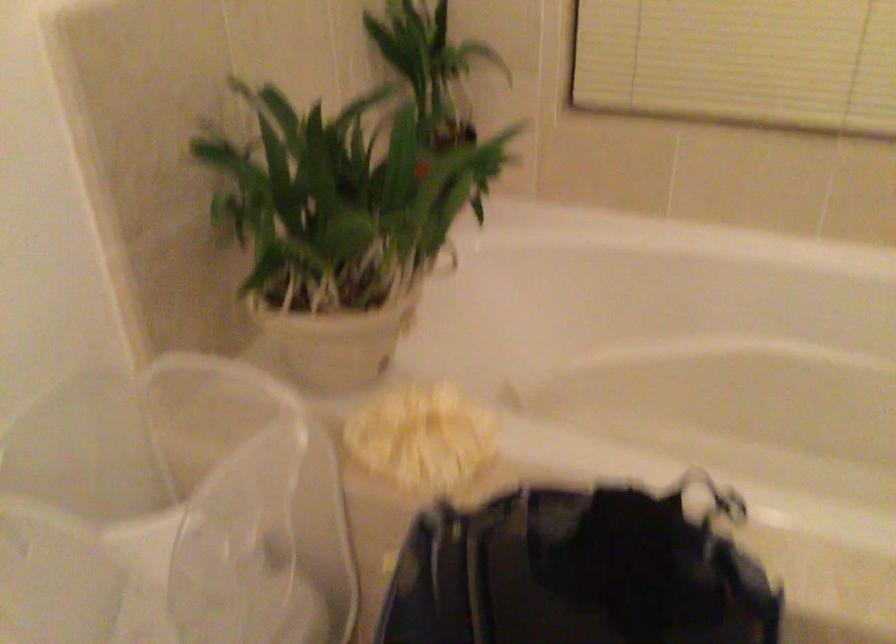
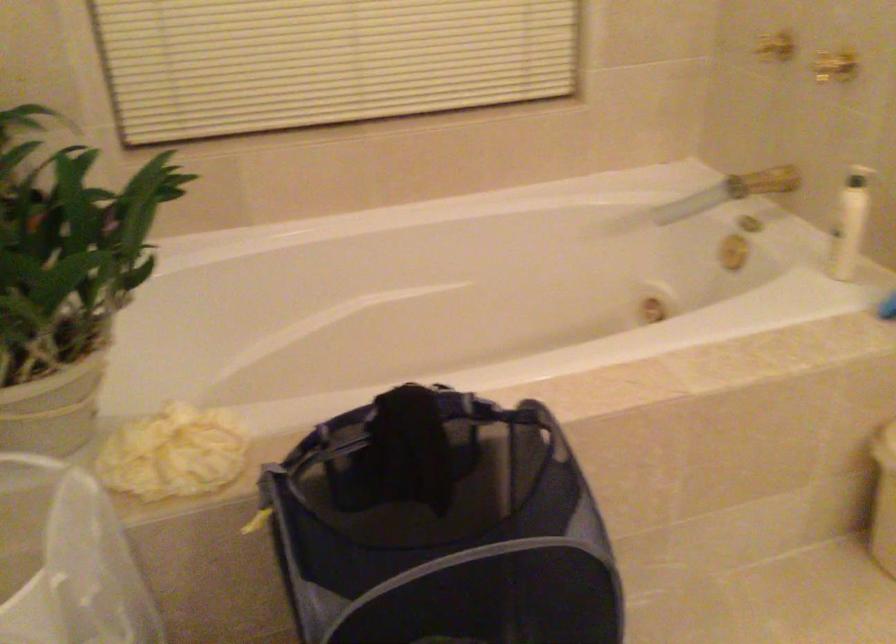
Question: The first image is from the beginning of the video and the second image is from the end. How did the camera likely rotate when shooting the video?

Choices:
 (A) Left
 (B) Right
 (C) Up
 (D) Down

Answer: (B)